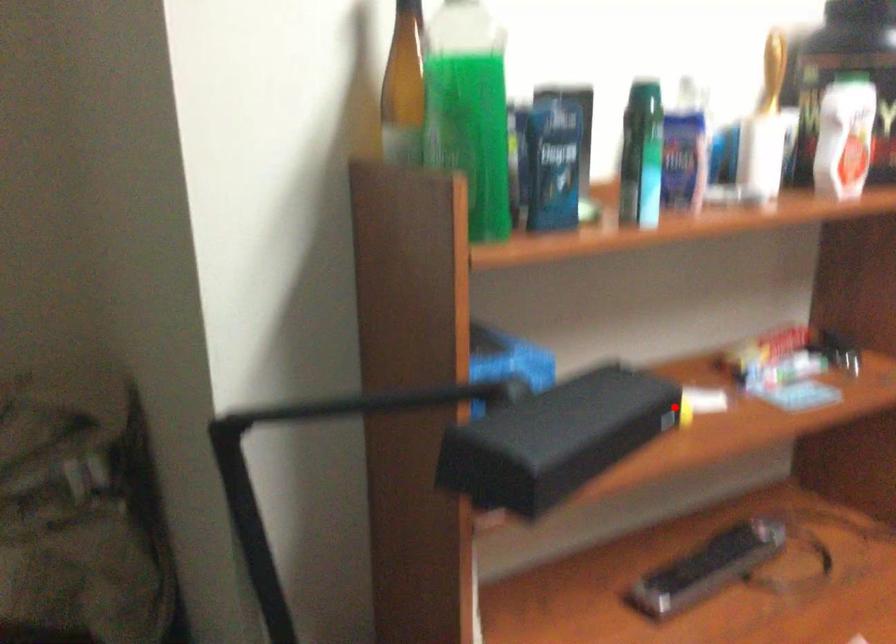
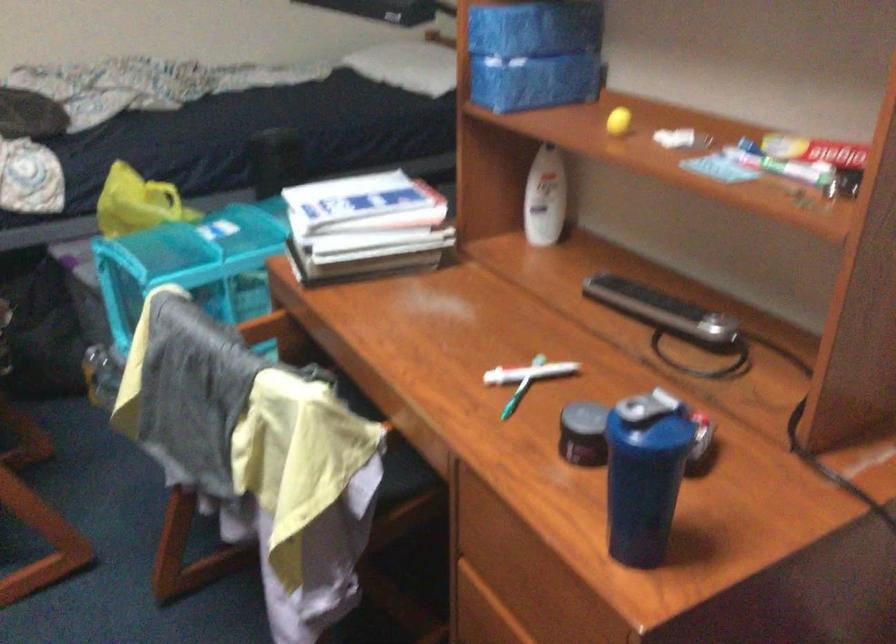
Question: I am providing you with two images of the same scene from different viewpoints. Given a red point in image1, look at the same physical point in image2. Is it:

Choices:
 (A) Closer to the viewpoint
 (B) Farther from the viewpoint

Answer: (B)